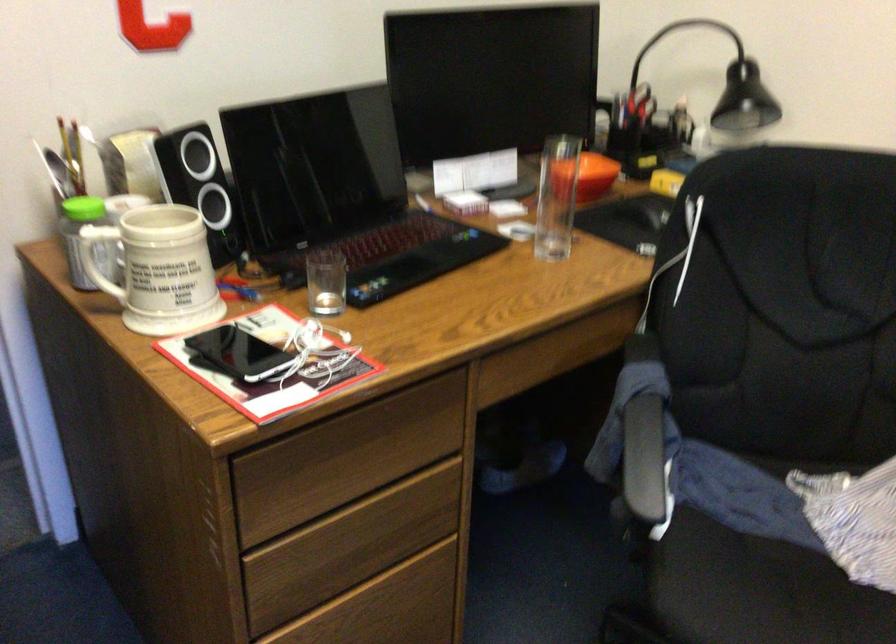
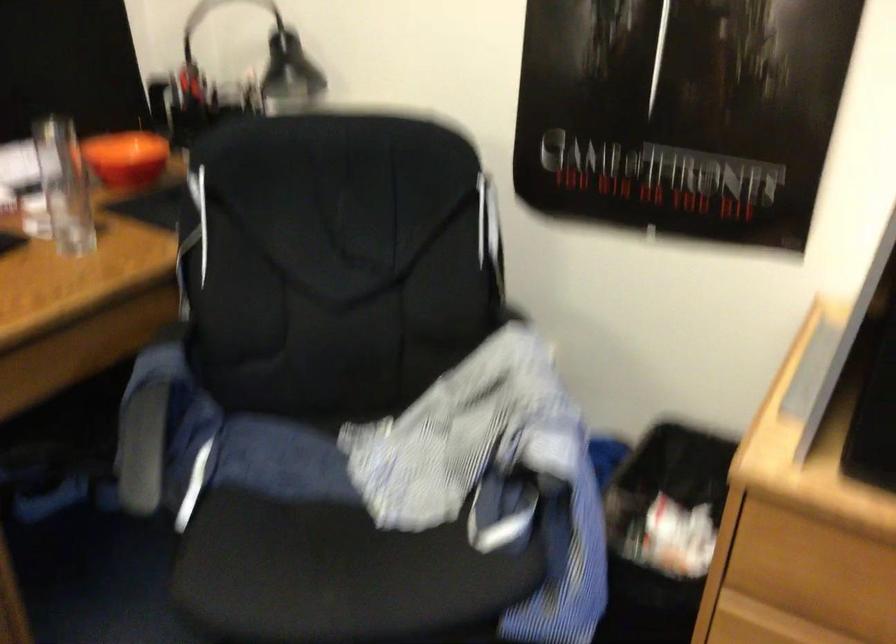
Find the pixel in the second image that matches (x=657, y=100) in the first image.

(233, 82)